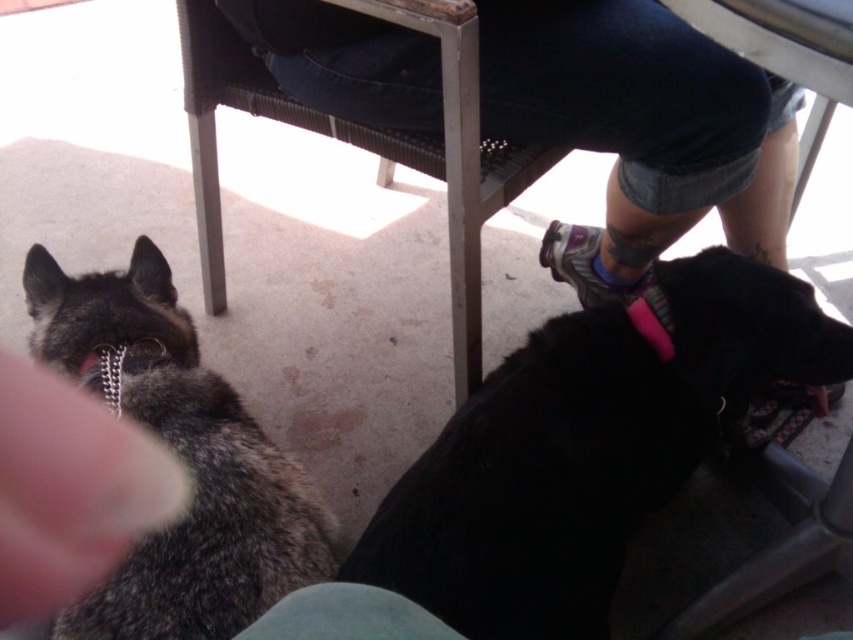
You are standing in the outdoor patio scene and want to determine which of the two points, point (39, 282) or point (460, 387), is nearer to you. Based on the spatial information provided, which point is closer?

Point (39, 282) is closer to the viewer than point (460, 387).

Consider the image. You are a photographer trying to capture a group photo of the gray fur dog at left and the metallic frame chair at upper center. Which object should you position closer to the camera to ensure both fit in the frame?

Since the gray fur dog at left has a lesser width compared to the metallic frame chair at upper center, you should position the metallic frame chair at upper center closer to the camera to ensure both fit in the frame.

You are standing at point point (279, 65) in the scene. Can you reach the person seated on the metal frame without moving your feet? The distance between you and the viewer is 1.18 meters. Assume your arm reaches 1 meter.

The distance between you and the viewer is 1.18 meters. Since your arm can only reach 1 meter, you cannot reach the person seated on the metal frame without moving your feet.